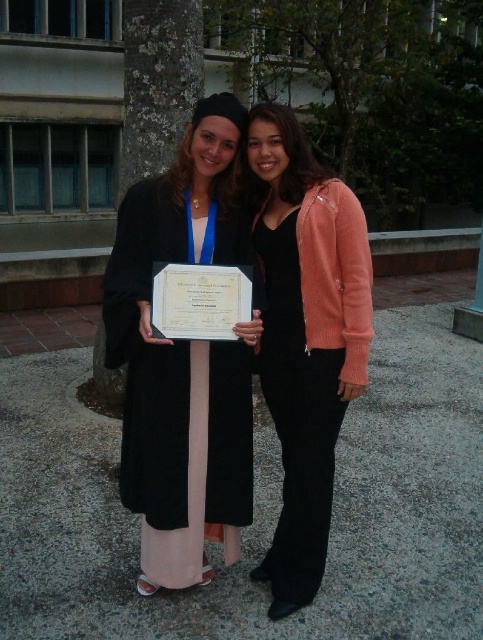
Locate an element on the screen. matte black graduation gown at center is located at coordinates (184, 358).

Is point (238, 497) in front of point (302, 602)?

No, (238, 497) is behind (302, 602).

Is point (210, 96) positioned after point (300, 301)?

Yes, it is.

Where is `matte black graduation gown at center`? This screenshot has height=640, width=483. matte black graduation gown at center is located at coordinates (184, 358).